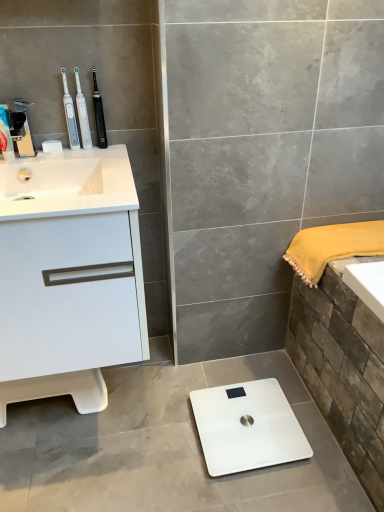
The width and height of the screenshot is (384, 512). In order to click on vacant area that lies in front of white glossy toothbrush at upper left, the first toothbrush when ordered from left to right in this screenshot , I will do tap(76, 160).